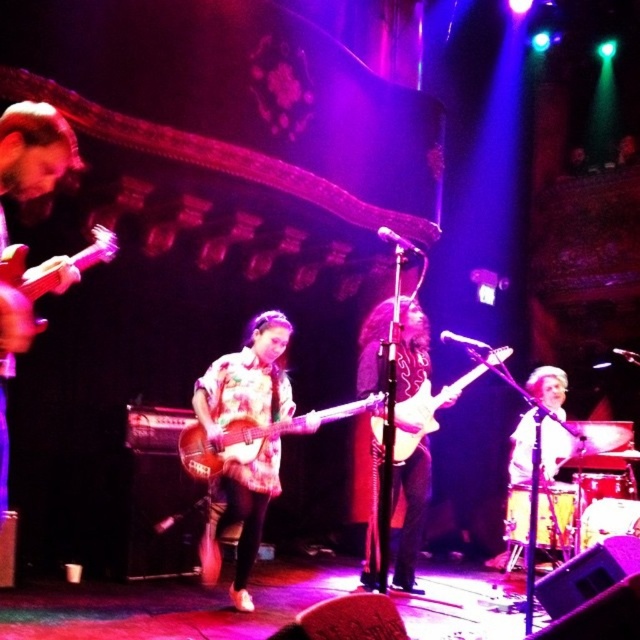
You are a stagehand preparing to adjust the lighting for the performance. You need to ensure that the light brown drum set at lower right is lit properly. Considering its position relative to the matte brown acoustic guitar at left, where should you direct the spotlight?

The light brown drum set at lower right is positioned under the matte brown acoustic guitar at left, so you should direct the spotlight towards the lower right area beneath the matte brown acoustic guitar at left to properly illuminate the drum set.

You are a photographer standing at the center of the stage. You want to capture the point at coordinate point (x=228, y=444). Which object is that point located on?

The point at coordinate (x=228, y=444) is located on the tie dye wood guitar at center.